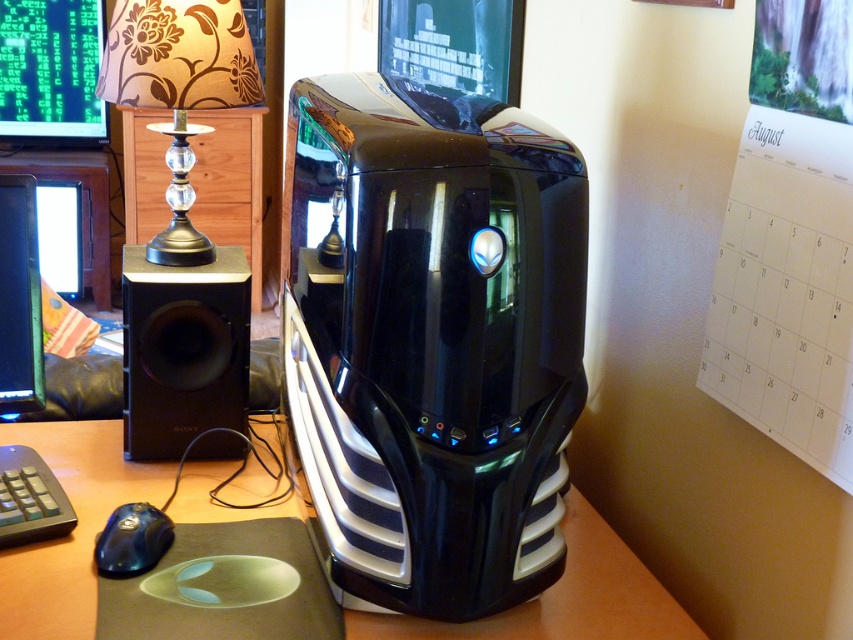
Question: Among these points, which one is farthest from the camera?

Choices:
 (A) (642, 621)
 (B) (50, 481)

Answer: (B)

Question: Is brown wooden table at center wider than metallic glass at left?

Choices:
 (A) yes
 (B) no

Answer: (A)

Question: Which point is closer to the camera?

Choices:
 (A) (733, 371)
 (B) (15, 524)

Answer: (A)

Question: Can you confirm if white paper calendar at upper right is positioned below matte black monitor at left?

Choices:
 (A) no
 (B) yes

Answer: (B)

Question: Can you confirm if black matte speaker at left is positioned to the left of metallic glass at left?

Choices:
 (A) yes
 (B) no

Answer: (B)

Question: Which of these objects is positioned farthest from the glossy black desktop at center?

Choices:
 (A) brown wooden table at center
 (B) blue glossy mouse at lower left
 (C) green matrix code at upper left
 (D) black matte speaker at left

Answer: (C)